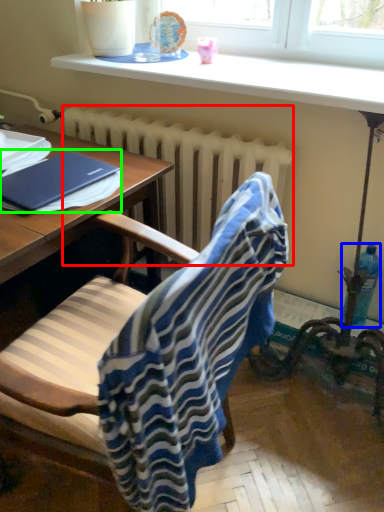
Question: Based on their relative distances, which object is farther from radiator (highlighted by a red box)? Choose from bottle (highlighted by a blue box) and notebook (highlighted by a green box).

Choices:
 (A) bottle
 (B) notebook

Answer: (A)